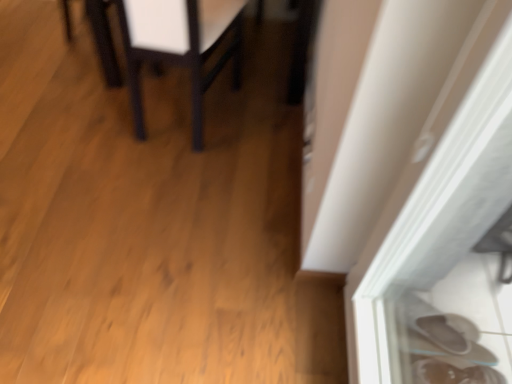
Identify the location of matte black table at upper left. (169, 45).

The width and height of the screenshot is (512, 384). What do you see at coordinates (169, 45) in the screenshot? I see `matte black table at upper left` at bounding box center [169, 45].

Where is `matte black table at upper left`? matte black table at upper left is located at coordinates (169, 45).